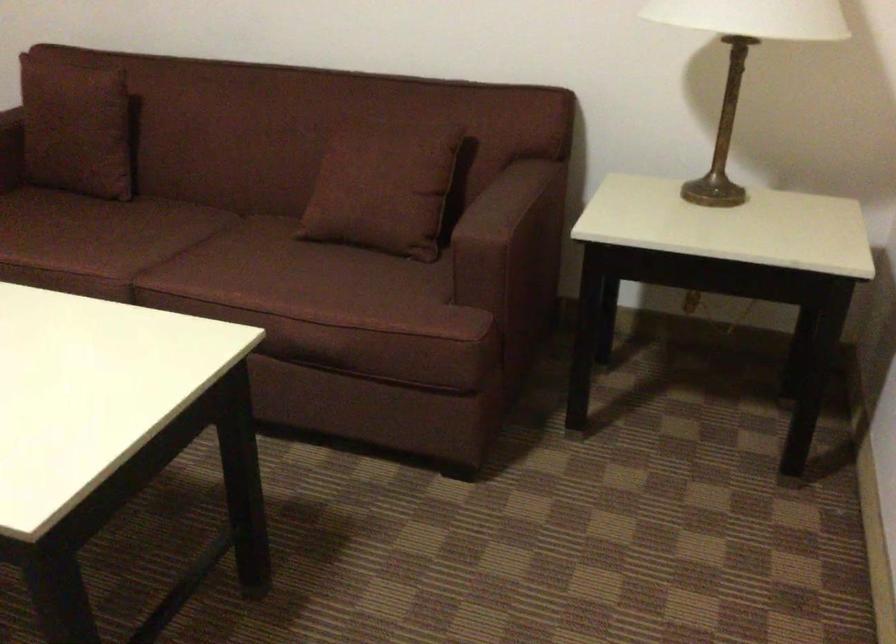
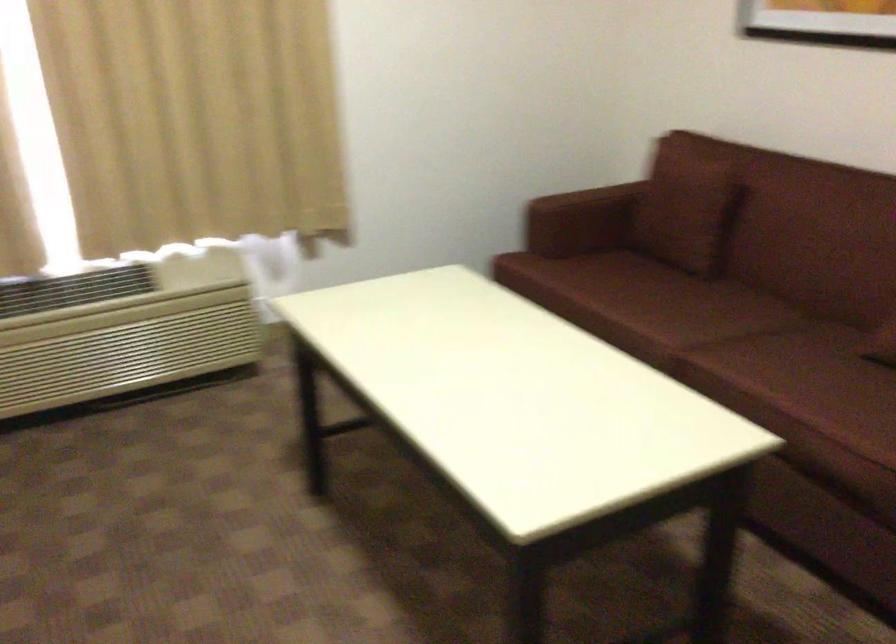
The point at (125, 240) is marked in the first image. Where is the corresponding point in the second image?

(682, 310)